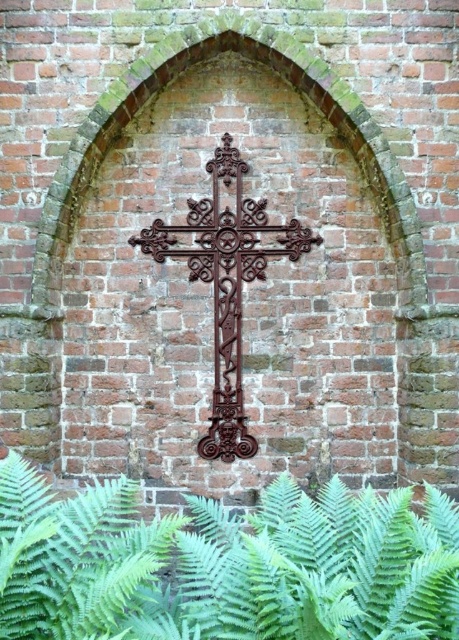
Question: Among these objects, which one is nearest to the camera?

Choices:
 (A) green leafy fern at lower center
 (B) rusty metal cross at center

Answer: (A)

Question: Is green leafy fern at lower center thinner than rusty metal cross at center?

Choices:
 (A) no
 (B) yes

Answer: (A)

Question: Is green leafy fern at lower center to the left of rusty metal cross at center from the viewer's perspective?

Choices:
 (A) no
 (B) yes

Answer: (B)

Question: Is green leafy fern at lower center wider than rusty metal cross at center?

Choices:
 (A) yes
 (B) no

Answer: (A)

Question: Which point is farther to the camera?

Choices:
 (A) green leafy fern at lower center
 (B) rusty metal cross at center

Answer: (B)